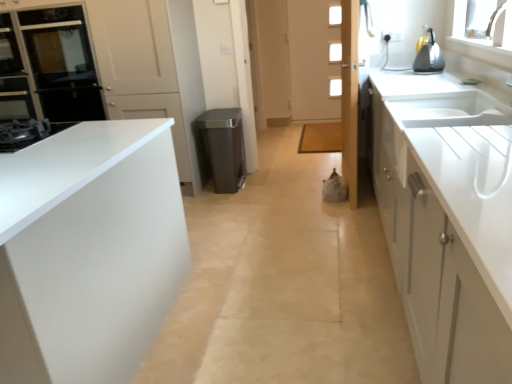
Question: Is point (312, 99) closer or farther from the camera than point (245, 132)?

Choices:
 (A) closer
 (B) farther

Answer: (B)

Question: Is white wooden door at center, positioned as the 1th door in right-to-left order, inside the boundaries of white glossy door at center, marked as the first door in a left-to-right arrangement, or outside?

Choices:
 (A) outside
 (B) inside

Answer: (A)

Question: Which of these objects is positioned closest to the white glossy door at center, the 2th door when ordered from front to back?

Choices:
 (A) black glass oven at upper left
 (B) metallic silver kettle at upper right
 (C) matte black stove at left
 (D) white wooden door at center, positioned as the 1th door in right-to-left order
 (E) white glossy cabinet at right, which is the second cabinetry from left to right

Answer: (A)

Question: Estimate the real-world distances between objects in this image. Which object is farther from the metallic silver kettle at upper right?

Choices:
 (A) black glass oven at upper left
 (B) white glossy cabinet at right, which is the second cabinetry from left to right
 (C) gray matte trash can at center
 (D) matte black stove at left
 (E) white glossy door at center, the 2th door when ordered from front to back

Answer: (A)